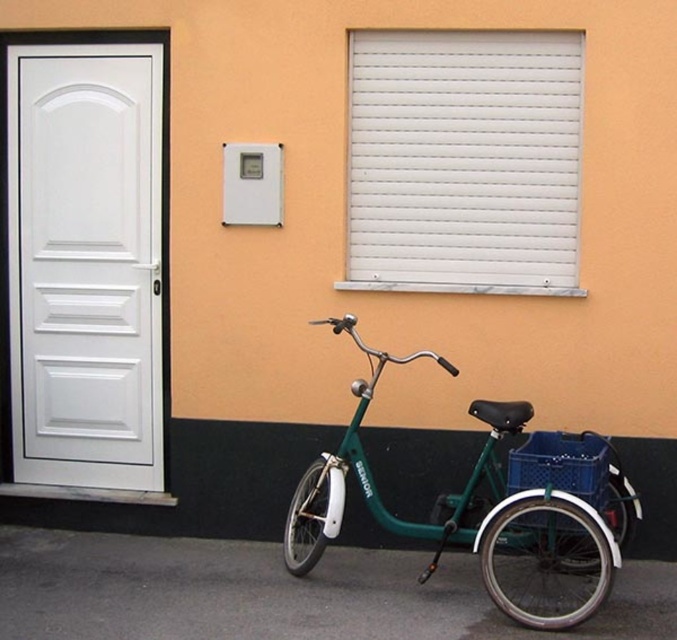
Does point (127, 378) come in front of point (320, 557)?

No, it is not.

Between point (110, 369) and point (546, 577), which one is positioned in front?

Point (546, 577) is more forward.

Which is in front, point (66, 296) or point (523, 554)?

Positioned in front is point (523, 554).

Image resolution: width=677 pixels, height=640 pixels. I want to click on white matte door at left, so click(x=85, y=262).